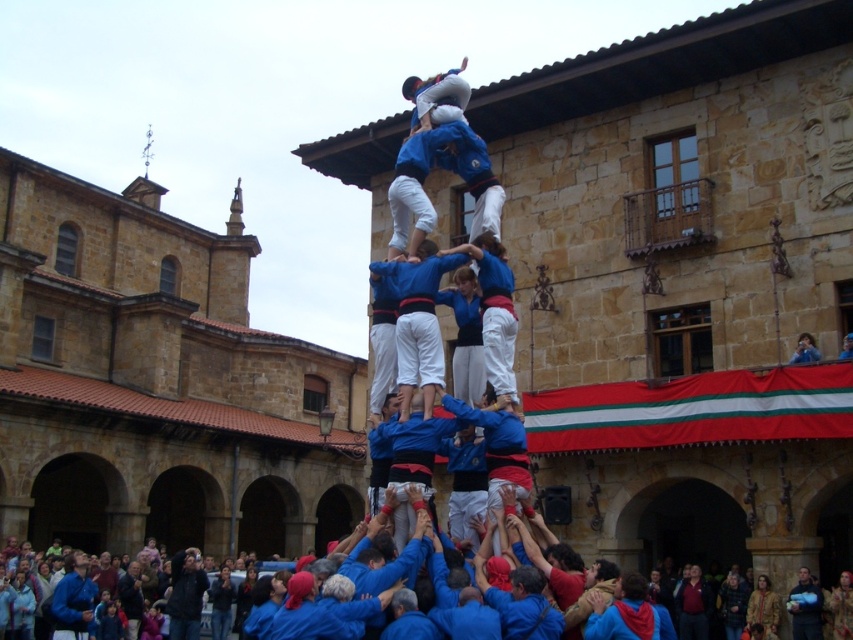
Question: Does blue cotton shirt at center lie in front of blue fabric person at center?

Choices:
 (A) no
 (B) yes

Answer: (B)

Question: Is blue cotton shirt at center thinner than blue fabric person at center?

Choices:
 (A) yes
 (B) no

Answer: (B)

Question: Among these objects, which one is farthest from the camera?

Choices:
 (A) blue cotton shirt at center
 (B) blue fabric person at center

Answer: (B)

Question: Considering the relative positions of blue cotton shirt at center and blue fabric person at center in the image provided, where is blue cotton shirt at center located with respect to blue fabric person at center?

Choices:
 (A) above
 (B) below

Answer: (A)